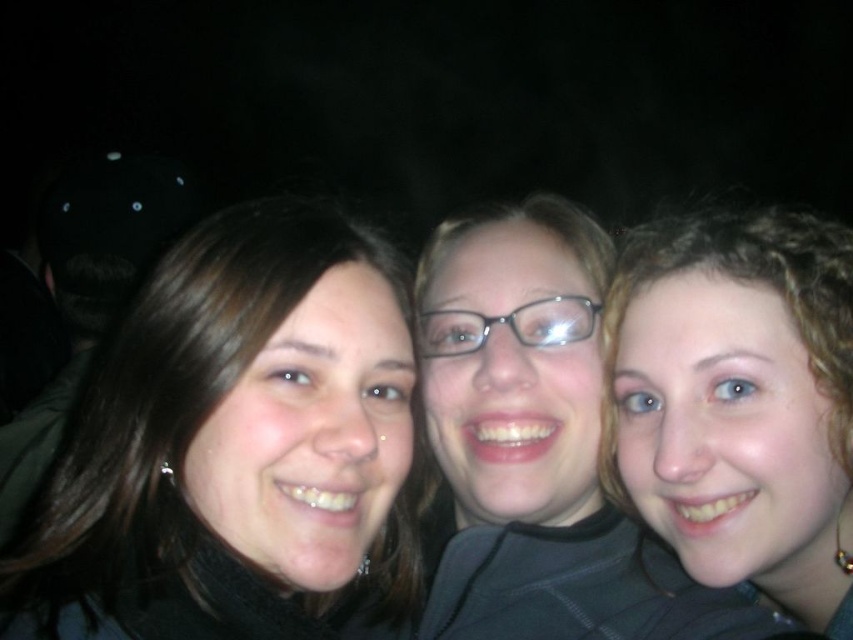
You are a photographer trying to adjust the lighting for a night portrait. You notice the curly hair at right and the matte black glasses at center. Which object is located lower in the image?

The curly hair at right is positioned under matte black glasses at center, so the curly hair at right is lower in the image.

You are a photographer trying to capture a group photo of three people. The people are positioned such that the curly hair at right is 77.08 centimeters away from the others. If you want to ensure all three are in focus, what should you adjust?

To ensure all three are in focus, adjust the camera to a smaller aperture for a larger depth of field, as the distance between the curly hair at right and the others is 77.08 centimeters.

You are taking a photo of the three people in the scene. You want to focus on the person at point [277,326] and the person at point [712,403]. Which of these two points is closer to the camera?

Point [277,326] is closer to the camera than point [712,403].